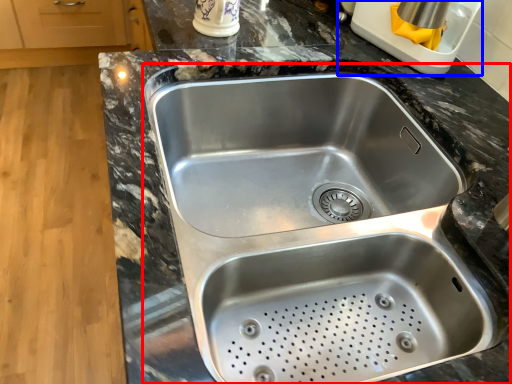
Question: Which object is closer to the camera taking this photo, sink (highlighted by a red box) or appliance (highlighted by a blue box)?

Choices:
 (A) sink
 (B) appliance

Answer: (A)